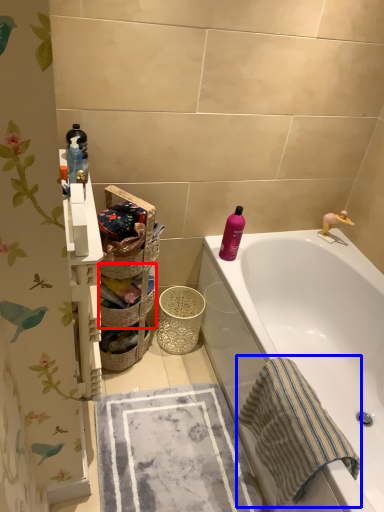
Question: Which object appears farthest to the camera in this image, basket (highlighted by a red box) or beach towel (highlighted by a blue box)?

Choices:
 (A) basket
 (B) beach towel

Answer: (A)